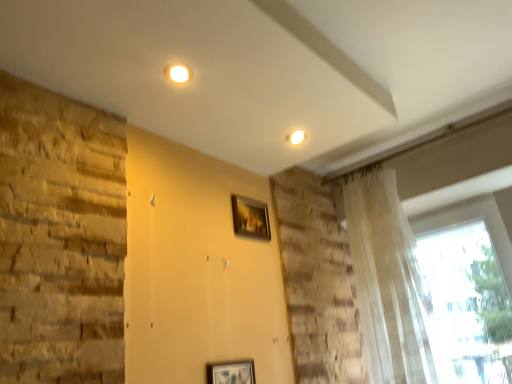
Question: Considering their positions, is wooden frame at center located in front of or behind translucent fabric curtain at upper right?

Choices:
 (A) front
 (B) behind

Answer: (B)

Question: Visually, is wooden frame at center positioned to the left or to the right of translucent fabric curtain at upper right?

Choices:
 (A) left
 (B) right

Answer: (A)

Question: From a real-world perspective, is wooden frame at center physically located above or below translucent fabric curtain at upper right?

Choices:
 (A) below
 (B) above

Answer: (B)

Question: Considering the positions of point (403, 365) and point (266, 210), is point (403, 365) closer or farther from the camera than point (266, 210)?

Choices:
 (A) farther
 (B) closer

Answer: (B)

Question: Looking at their shapes, would you say translucent fabric curtain at upper right is wider or thinner than wooden frame at center?

Choices:
 (A) wide
 (B) thin

Answer: (A)

Question: Visually, is translucent fabric curtain at upper right positioned to the left or to the right of wooden frame at center?

Choices:
 (A) left
 (B) right

Answer: (B)

Question: From the image's perspective, relative to wooden frame at center, is translucent fabric curtain at upper right above or below?

Choices:
 (A) above
 (B) below

Answer: (B)